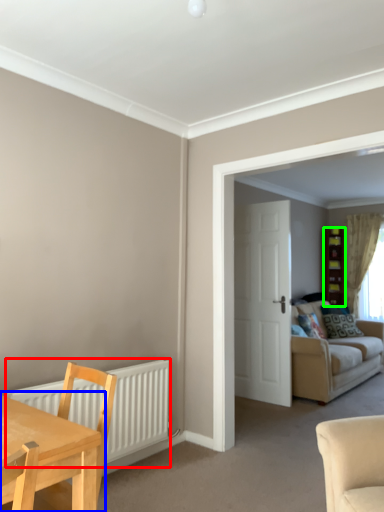
Question: Which is nearer to the radiator (highlighted by a red box)? table (highlighted by a blue box) or cabinetry (highlighted by a green box).

Choices:
 (A) table
 (B) cabinetry

Answer: (A)